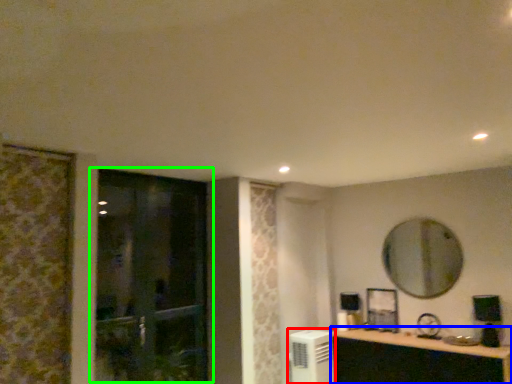
Question: Estimate the real-world distances between objects in this image. Which object is closer to air conditioner (highlighted by a red box), cabinetry (highlighted by a blue box) or door (highlighted by a green box)?

Choices:
 (A) cabinetry
 (B) door

Answer: (A)